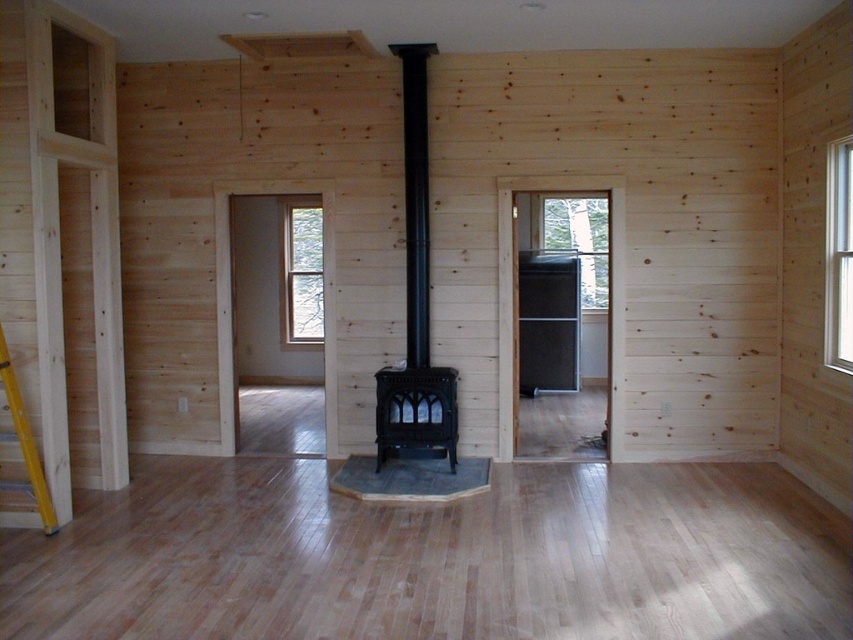
Question: Is black cast iron fireplace at center above yellow wood ladder at left?

Choices:
 (A) yes
 (B) no

Answer: (A)

Question: Which of the following is the farthest from the observer?

Choices:
 (A) black matte fireplace at center
 (B) black cast iron fireplace at center
 (C) yellow wood ladder at left

Answer: (A)

Question: Does black cast iron fireplace at center appear over black matte fireplace at center?

Choices:
 (A) yes
 (B) no

Answer: (A)

Question: Estimate the real-world distances between objects in this image. Which object is closer to the yellow wood ladder at left?

Choices:
 (A) black matte fireplace at center
 (B) black cast iron fireplace at center

Answer: (A)

Question: Among these points, which one is nearest to the camera?

Choices:
 (A) (397, 426)
 (B) (376, 404)
 (C) (22, 492)

Answer: (C)

Question: Is black cast iron fireplace at center thinner than black matte fireplace at center?

Choices:
 (A) yes
 (B) no

Answer: (A)